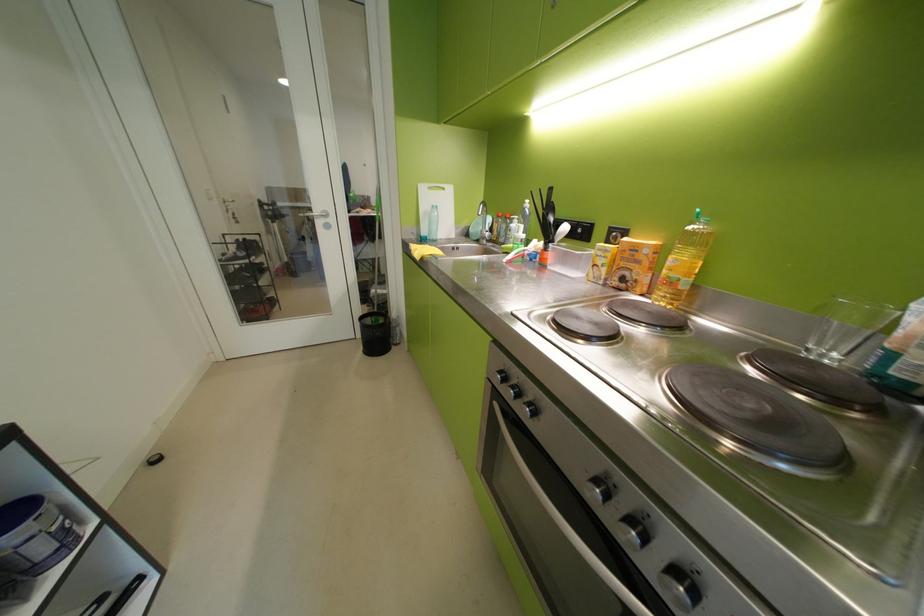
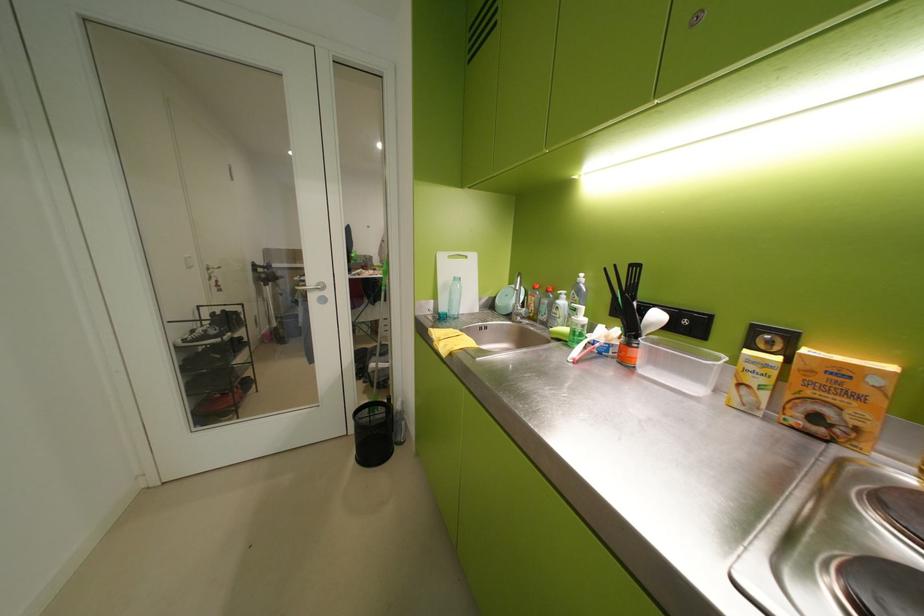
The point at (562, 220) is marked in the first image. Where is the corresponding point in the second image?

(646, 304)